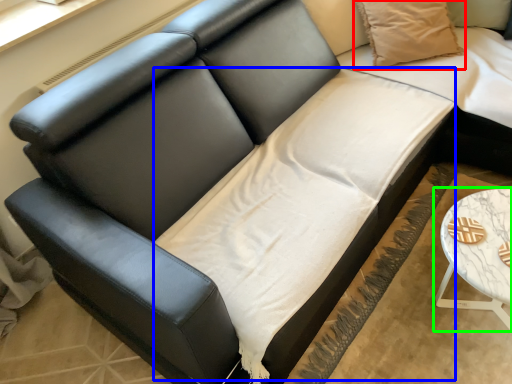
Question: Based on their relative distances, which object is nearer to pillow (highlighted by a red box)? Choose from sheet (highlighted by a blue box) and table (highlighted by a green box).

Choices:
 (A) sheet
 (B) table

Answer: (A)